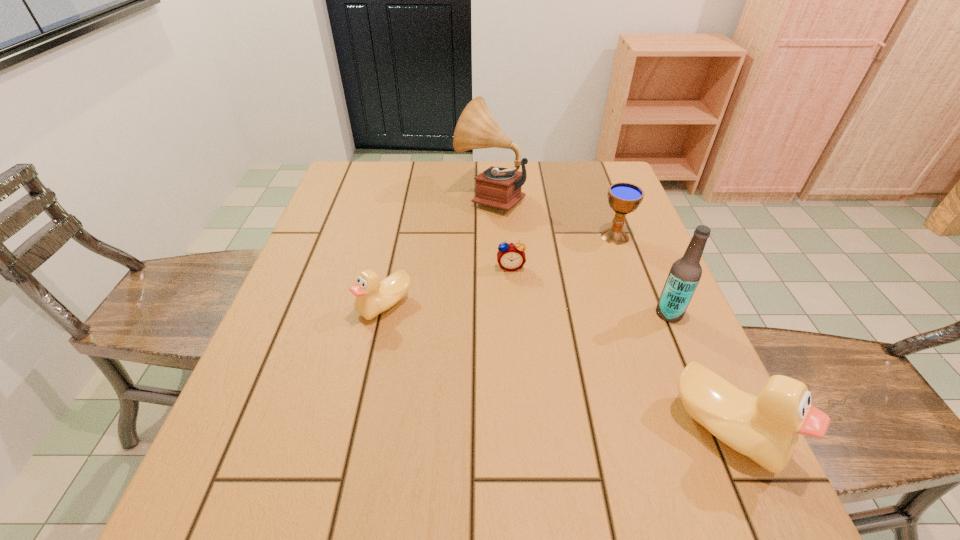
At what (x,y) coordinates should I click in order to perform the action: click on the left duck. Please return your answer as a coordinate pair (x, y). The height and width of the screenshot is (540, 960). Looking at the image, I should click on (373, 296).

Find the location of `the shorter duck`. the shorter duck is located at coordinates (373, 296).

Find the location of a particular element. The image size is (960, 540). the nearer duck is located at coordinates (766, 429).

Where is `the taller duck`? The height and width of the screenshot is (540, 960). the taller duck is located at coordinates (766, 429).

Locate an element on the screen. Image resolution: width=960 pixels, height=540 pixels. the tallest object is located at coordinates pos(497,187).

This screenshot has width=960, height=540. I want to click on phonograph record, so click(497, 187).

This screenshot has width=960, height=540. What are the coordinates of `beer bottle` in the screenshot? It's located at (685, 273).

Identify the location of alarm clock. The width and height of the screenshot is (960, 540). (511, 257).

I want to click on the fourth nearest object, so click(511, 257).

What are the coordinates of `chalice` in the screenshot? It's located at (624, 198).